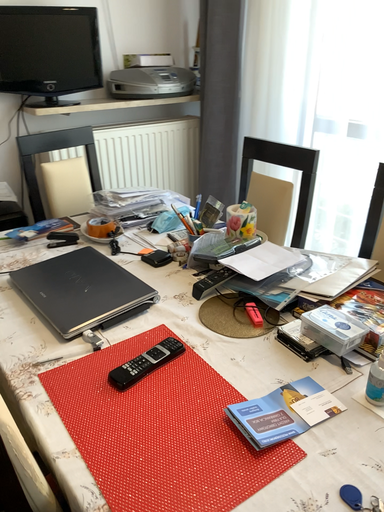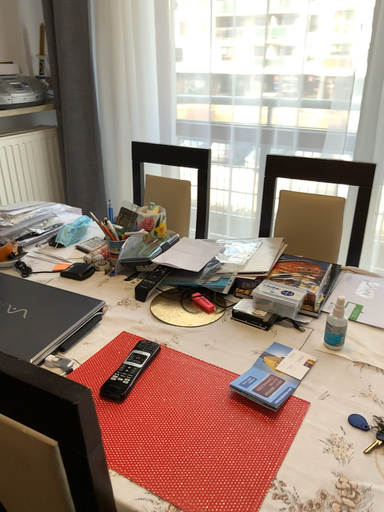
Question: How did the camera likely rotate when shooting the video?

Choices:
 (A) rotated left
 (B) rotated right

Answer: (B)